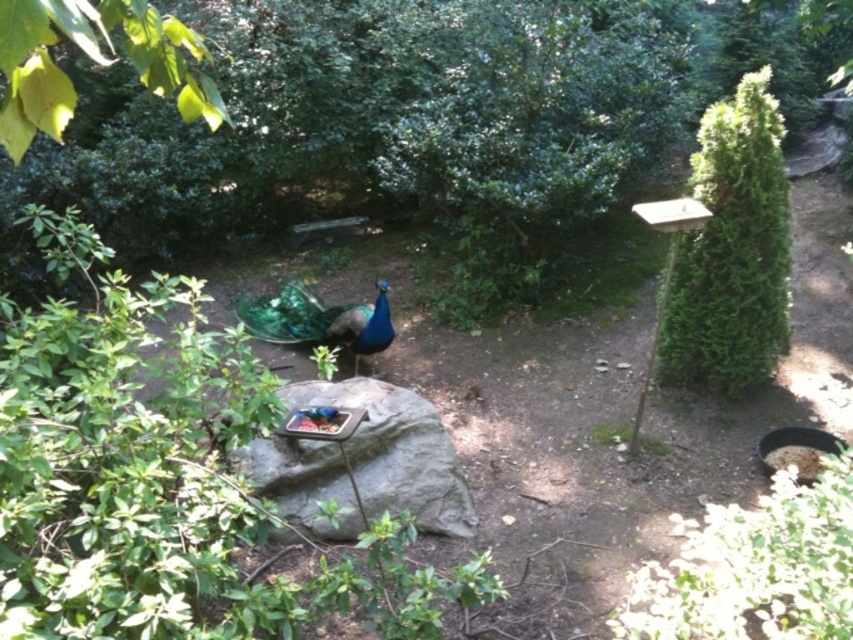
Who is shorter, green leafy bush at lower right or gray rock at center?

gray rock at center

Is green leafy bush at lower right closer to the viewer compared to gray rock at center?

Yes.

Between point (849, 580) and point (403, 477), which one is positioned behind?

The point (403, 477) is behind.

Locate an element on the screen. The image size is (853, 640). green leafy bush at lower right is located at coordinates (755, 566).

Between point (695, 317) and point (328, 339), which one is positioned in front?

Point (695, 317)

Is green leafy bush at right wider than shiny blue-green peacock at center?

No.

In order to click on green leafy bush at right in this screenshot , I will do coord(732,250).

You are a GUI agent. You are given a task and a screenshot of the screen. Output one action in this format:
    pyautogui.click(x=<x>, y=<y>)
    Task: Click on the green leafy bush at right
    Image resolution: width=853 pixels, height=640 pixels.
    Given the screenshot: What is the action you would take?
    pyautogui.click(x=732, y=250)

Is green leafy bush at right in front of gray rock at center?

No, it is not.

Which is in front, point (717, 276) or point (440, 428)?

Point (440, 428) is in front.

Find the location of `green leafy bush at right`. green leafy bush at right is located at coordinates click(732, 250).